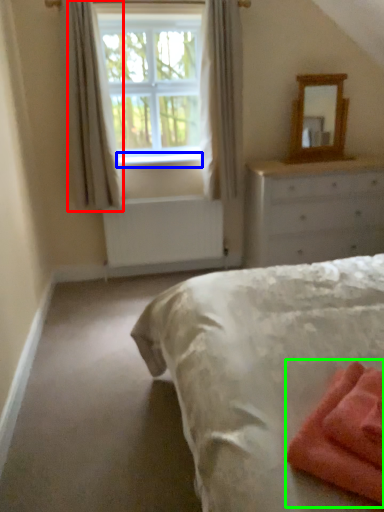
Question: Which object is the farthest from curtain (highlighted by a red box)? Choose among these: window sill (highlighted by a blue box) or material (highlighted by a green box).

Choices:
 (A) window sill
 (B) material

Answer: (B)